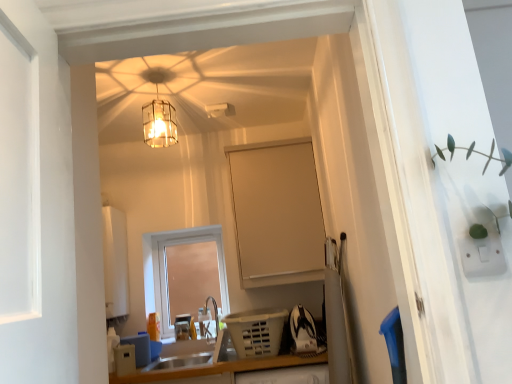
Question: Is beige matte cabinet at center spatially inside satin silver sink at lower center, or outside of it?

Choices:
 (A) inside
 (B) outside

Answer: (B)

Question: Is beige matte cabinet at center in front of or behind satin silver sink at lower center in the image?

Choices:
 (A) front
 (B) behind

Answer: (B)

Question: Which object is positioned farthest from the satin silver sink at lower center?

Choices:
 (A) white plastic laundry basket at lower center, which is the second appliance in left-to-right order
 (B) beige matte cabinet at center
 (C) translucent glass lampshade at upper center
 (D) matte white window at center
 (E) white plastic speaker at lower left, the 2th appliance when ordered from right to left

Answer: (C)

Question: Considering the real-world distances, which object is farthest from the white plastic speaker at lower left, the 2th appliance when ordered from right to left?

Choices:
 (A) white plastic laundry basket at lower center, which is the second appliance in left-to-right order
 (B) translucent glass lampshade at upper center
 (C) matte white window at center
 (D) beige matte cabinet at center
 (E) satin silver sink at lower center

Answer: (B)